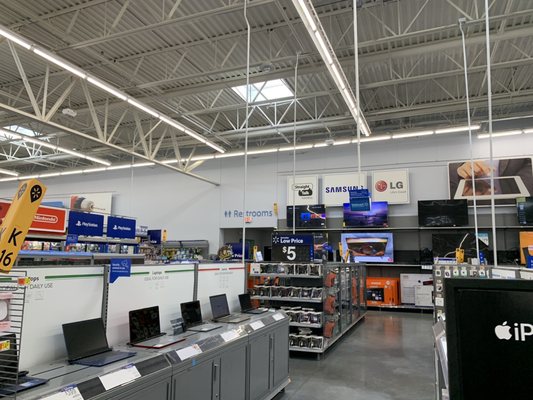
Find the location of a particular element. metal cabinets is located at coordinates [x=260, y=355].